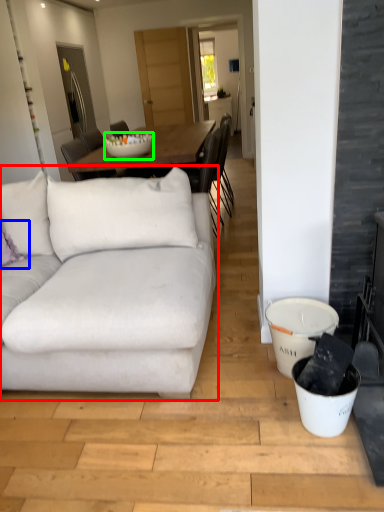
Question: Which object is the closest to the studio couch (highlighted by a red box)? Choose among these: pillow (highlighted by a blue box) or bowl (highlighted by a green box).

Choices:
 (A) pillow
 (B) bowl

Answer: (A)